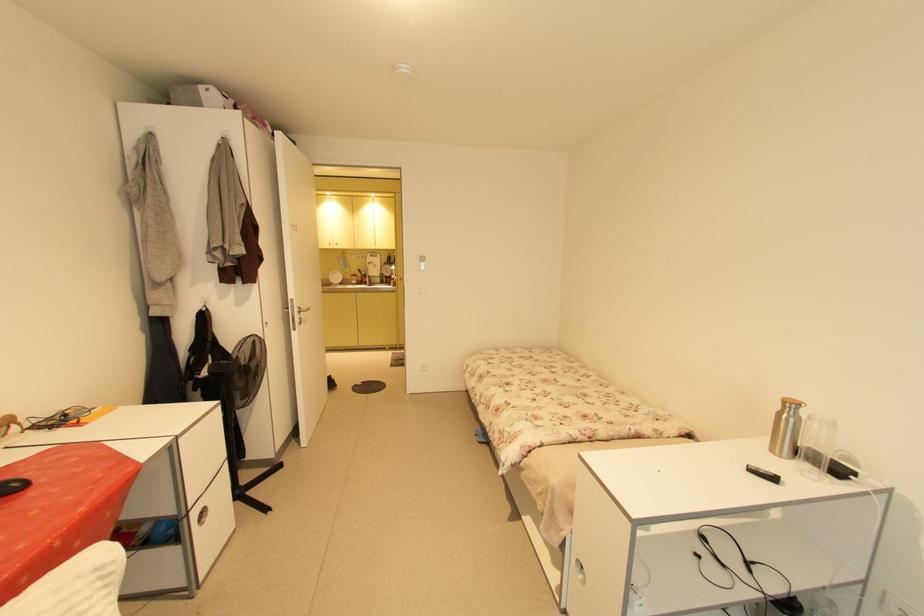
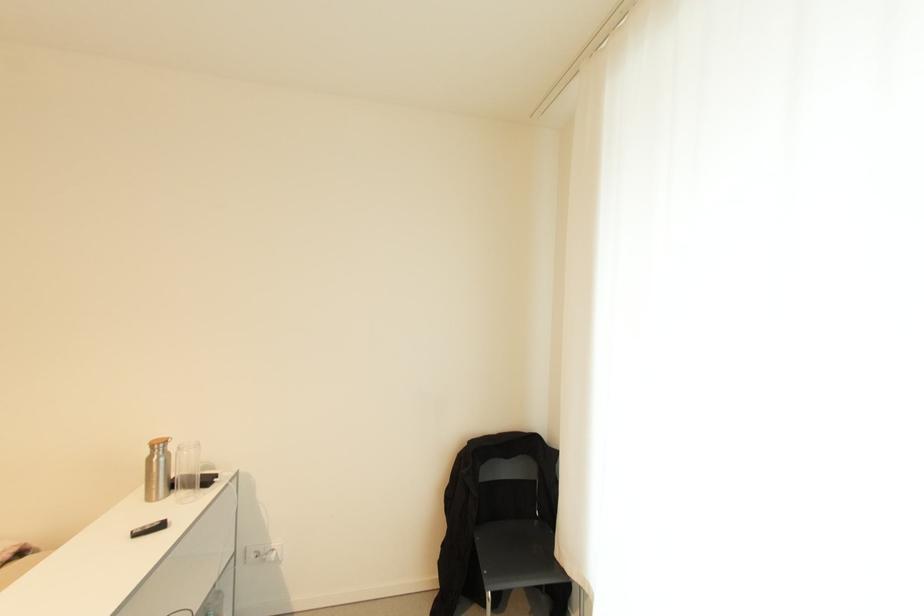
Question: Based on the continuous images, in which direction is the camera rotating? Reply with the corresponding letter.

Choices:
 (A) Left
 (B) Right
 (C) Up
 (D) Down

Answer: (B)